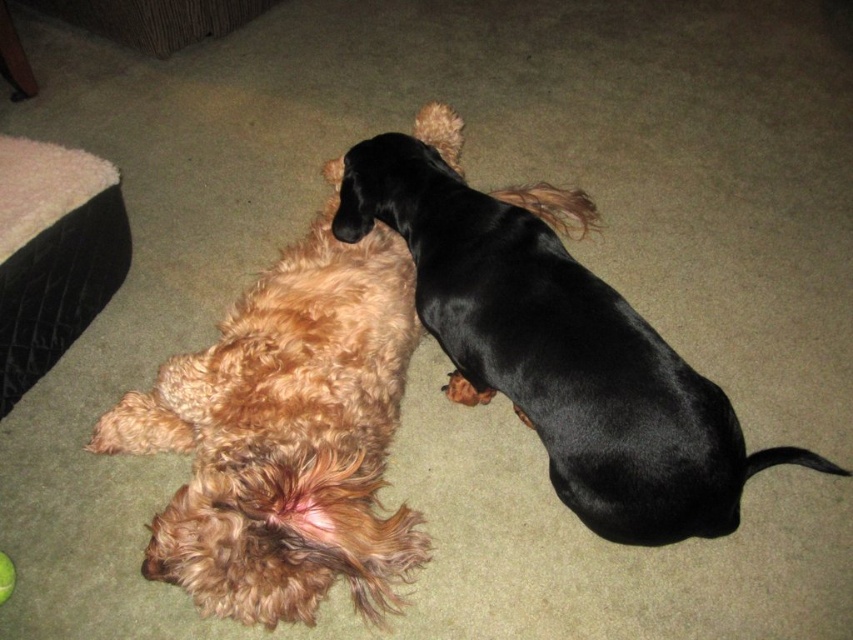
Question: Estimate the real-world distances between objects in this image. Which object is farther from the black quilted dog bed at left?

Choices:
 (A) fuzzy brown dog at center
 (B) black shiny dog at center

Answer: (B)

Question: Among these objects, which one is farthest from the camera?

Choices:
 (A) black quilted dog bed at left
 (B) fuzzy brown dog at center

Answer: (A)

Question: Which of the following is the closest to the observer?

Choices:
 (A) black quilted dog bed at left
 (B) fuzzy brown dog at center
 (C) black shiny dog at center

Answer: (B)

Question: Does fuzzy brown dog at center have a greater width compared to black quilted dog bed at left?

Choices:
 (A) no
 (B) yes

Answer: (B)

Question: Can you confirm if fuzzy brown dog at center is positioned below black shiny dog at center?

Choices:
 (A) no
 (B) yes

Answer: (B)

Question: Is fuzzy brown dog at center wider than black shiny dog at center?

Choices:
 (A) no
 (B) yes

Answer: (A)